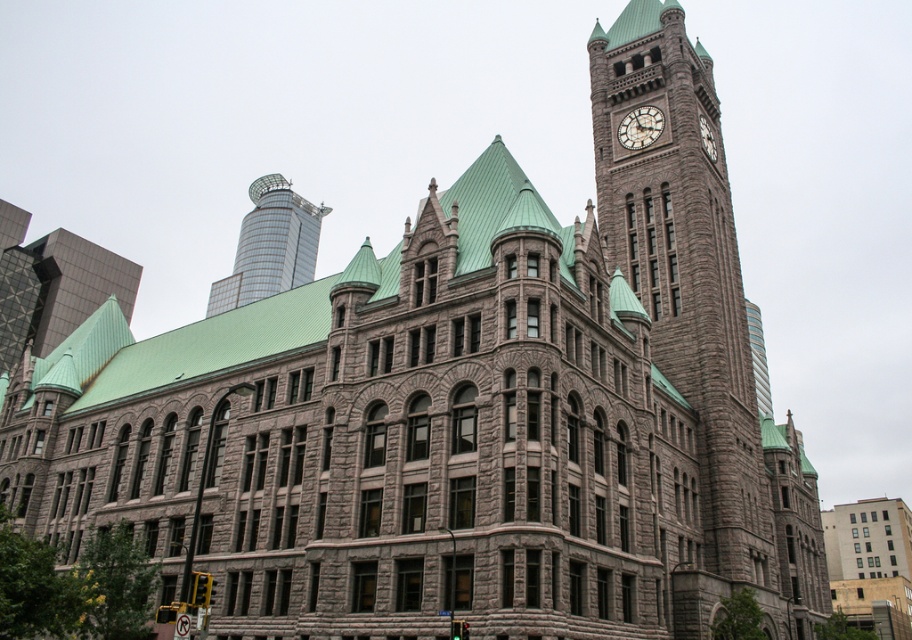
You are standing on the street in front of the historic building. You notice the shiny glass skyscraper at upper left and the matte gray clock at upper right in your view. Which object appears closer to you based on their positions?

The shiny glass skyscraper at upper left appears closer to you because the matte gray clock at upper right is positioned behind it.

You are standing in front of the historic building and want to take a photo. You notice two points marked on the building. The first point is at coordinate point (275, 177) and the second is at point (631, 122). Which point is closer to your camera when you take the photo?

Point (275, 177) is closer to the camera than point (631, 122) because it is further to the camera according to the description.

Based on the photo, you are standing in front of the historic building and want to take a photo of both the gray stone clock tower at upper center and the shiny glass skyscraper at upper left. Which one should you focus on first to ensure both are in the frame?

You should focus on the gray stone clock tower at upper center first since it is closer to you than the shiny glass skyscraper at upper left, allowing both to be captured in the frame.